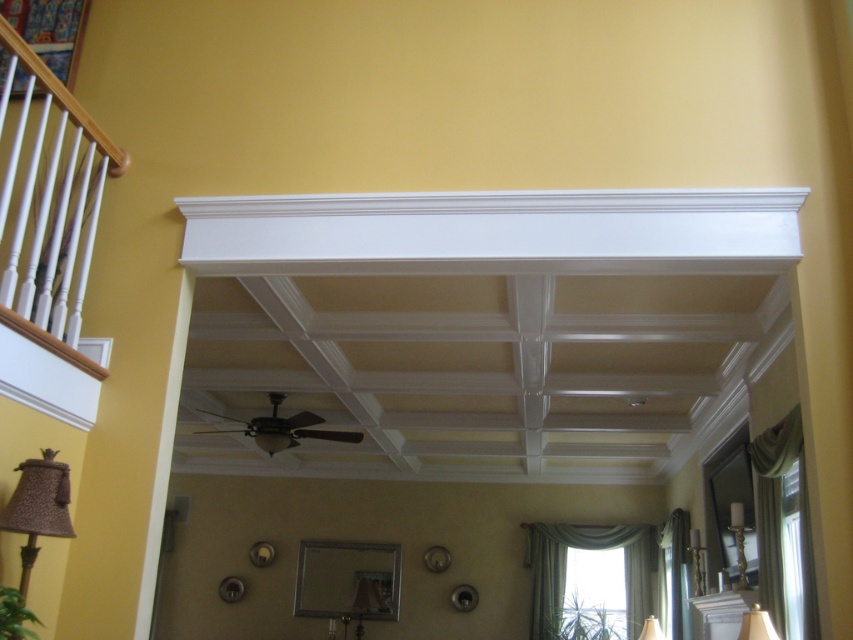
Question: Is white fabric lampshade at lower right thinner than matte white lampshade at lower right?

Choices:
 (A) no
 (B) yes

Answer: (A)

Question: Which object appears closest to the camera in this image?

Choices:
 (A) matte white lampshade at lower right
 (B) white fabric lampshade at lower right

Answer: (B)

Question: Does white fabric lampshade at lower right appear over matte white lampshade at lower right?

Choices:
 (A) yes
 (B) no

Answer: (A)

Question: Which point is closer to the camera?

Choices:
 (A) white fabric lampshade at lower right
 (B) matte white lampshade at lower right

Answer: (A)

Question: Does white fabric lampshade at lower right have a smaller size compared to matte white lampshade at lower right?

Choices:
 (A) yes
 (B) no

Answer: (A)